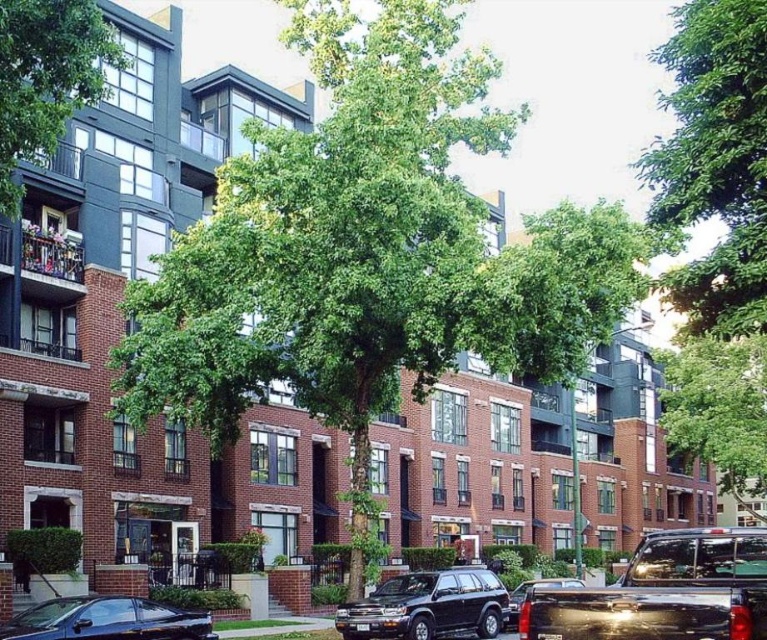
Who is taller, green leafy tree at upper right or shiny black suv at center?

green leafy tree at upper right

Between point (719, 403) and point (351, 609), which one is positioned behind?

Positioned behind is point (719, 403).

Which is behind, point (752, 412) or point (479, 588)?

Point (752, 412)

The width and height of the screenshot is (767, 640). Find the location of `green leafy tree at upper right`. green leafy tree at upper right is located at coordinates (718, 406).

Between green leafy tree at center and shiny black truck at lower right, which one is positioned lower?

shiny black truck at lower right is below.

Is point (453, 234) in front of point (731, 544)?

No, it is not.

I want to click on green leafy tree at center, so click(x=369, y=253).

The height and width of the screenshot is (640, 767). I want to click on green leafy tree at center, so point(369,253).

Does green leafy tree at upper center appear over green leafy tree at upper right?

Yes, green leafy tree at upper center is above green leafy tree at upper right.

This screenshot has width=767, height=640. Identify the location of green leafy tree at upper center. (713, 161).

The image size is (767, 640). I want to click on green leafy tree at upper center, so click(713, 161).